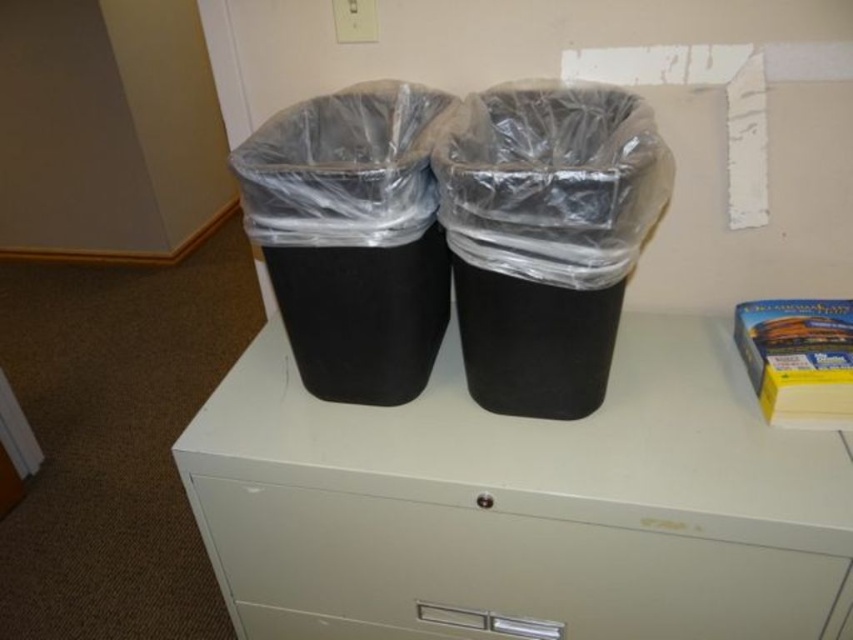
Question: Is white matte drawer at center smaller than yellow cardboard box at upper right?

Choices:
 (A) no
 (B) yes

Answer: (A)

Question: Does white matte/file cabinet at center lie in front of white matte drawer at center?

Choices:
 (A) no
 (B) yes

Answer: (B)

Question: Which of the following is the closest to the observer?

Choices:
 (A) (428, 554)
 (B) (740, 333)

Answer: (A)

Question: Among these points, which one is farthest from the camera?

Choices:
 (A) (764, 358)
 (B) (461, 396)
 (C) (235, 604)

Answer: (C)

Question: Can you confirm if white matte/file cabinet at center is thinner than white matte drawer at center?

Choices:
 (A) no
 (B) yes

Answer: (A)

Question: Considering the real-world distances, which object is farthest from the white matte/file cabinet at center?

Choices:
 (A) yellow cardboard box at upper right
 (B) white matte drawer at center

Answer: (A)